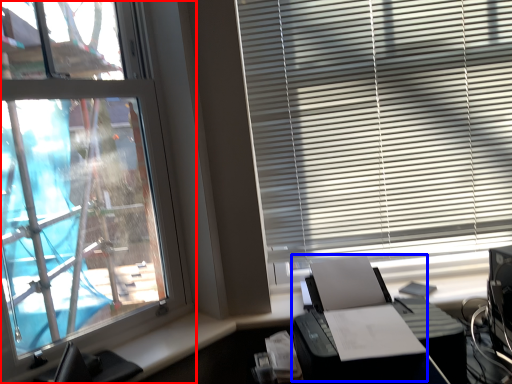
Question: Which object appears farthest to the camera in this image, window (highlighted by a red box) or printer (highlighted by a blue box)?

Choices:
 (A) window
 (B) printer

Answer: (B)